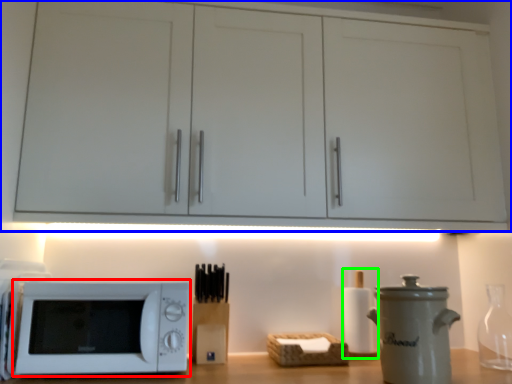
Question: Estimate the real-world distances between objects in this image. Which object is closer to microwave oven (highlighted by a red box), cabinetry (highlighted by a blue box) or bottle (highlighted by a green box)?

Choices:
 (A) cabinetry
 (B) bottle

Answer: (A)